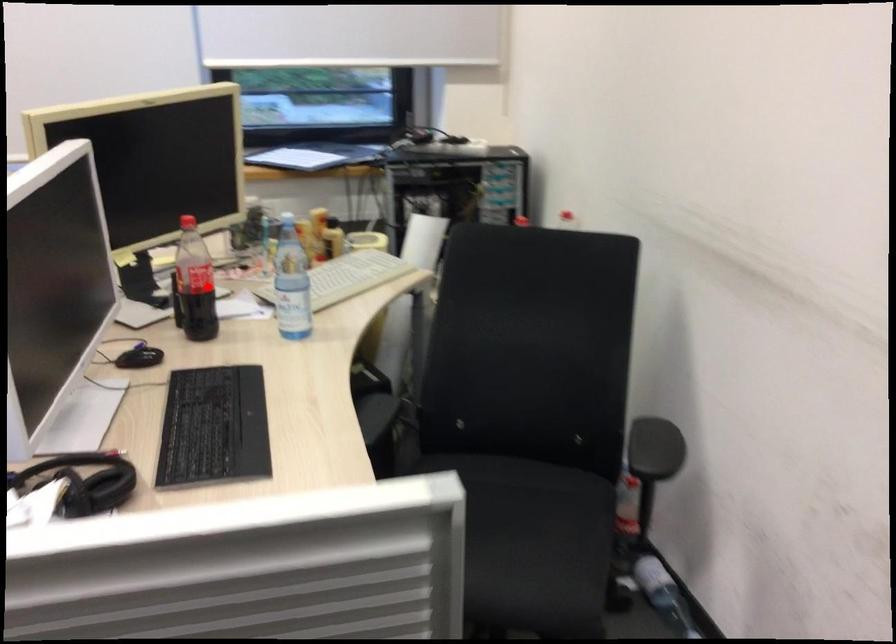
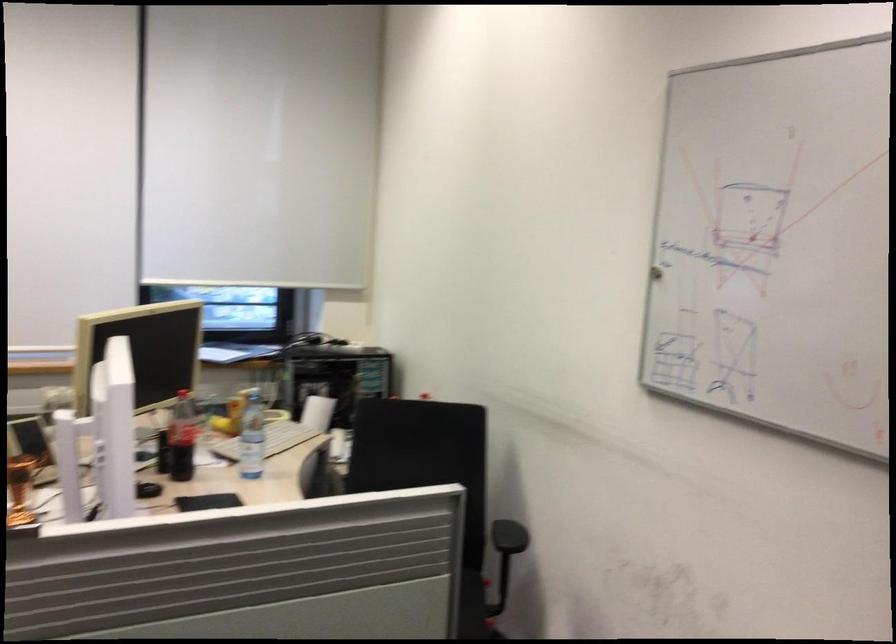
Find the pixel in the second image that matches the highlighted location in the first image.

(182, 438)